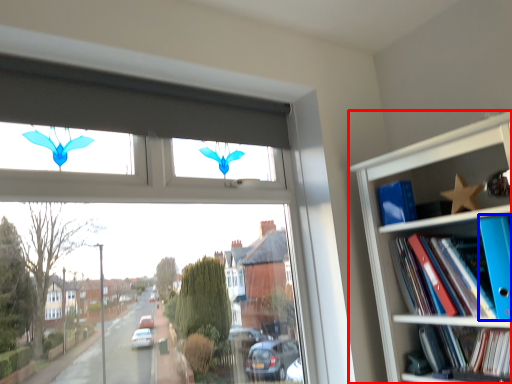
Question: Which object appears farthest to the camera in this image, bookcase (highlighted by a red box) or paperback book (highlighted by a blue box)?

Choices:
 (A) bookcase
 (B) paperback book

Answer: (B)